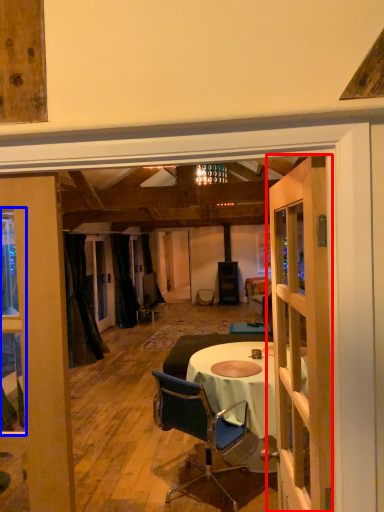
Question: Which object appears closest to the camera in this image, door (highlighted by a red box) or window (highlighted by a blue box)?

Choices:
 (A) door
 (B) window

Answer: (A)